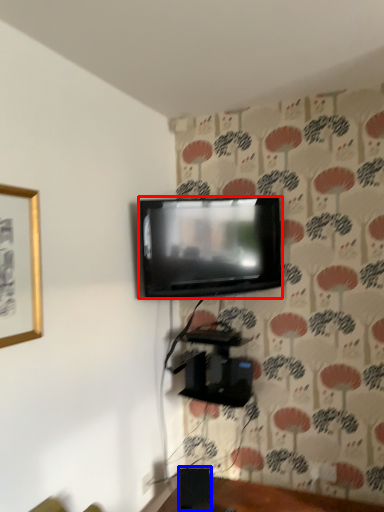
Question: Which object appears farthest to the camera in this image, television (highlighted by a red box) or speaker (highlighted by a blue box)?

Choices:
 (A) television
 (B) speaker

Answer: (A)